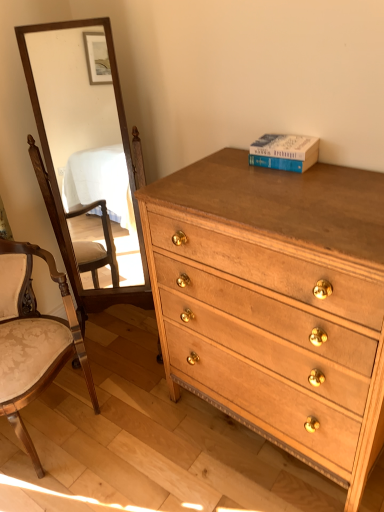
Identify the location of space that is in front of wooden mirror at left. Image resolution: width=384 pixels, height=512 pixels. (137, 391).